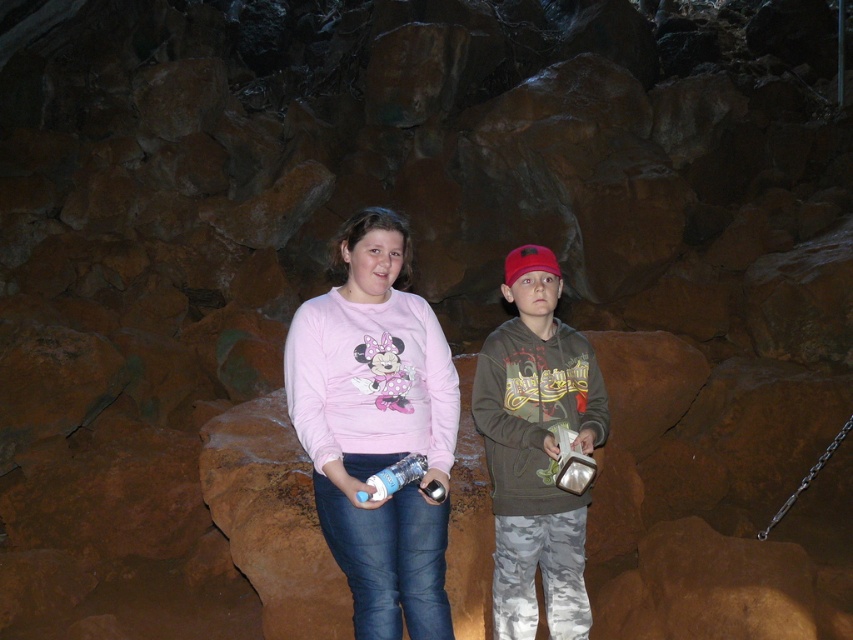
You are inside a cave with dim lighting. You see a matte pink sweatshirt at center and camouflage pants at center. Which object is shorter?

The matte pink sweatshirt at center is shorter than the camouflage pants at center.

You are a photographer trying to capture a portrait of the person wearing the matte pink sweatshirt at center and camouflage pants at center in the cave. Since the lighting is dim, you want to ensure the sweatshirt and pants are both visible. Based on their positions, which clothing item should you focus on first to ensure proper exposure?

The matte pink sweatshirt at center is above camouflage pants at center, so you should focus on the matte pink sweatshirt at center first because it is closer to the light source and might be better lit, ensuring proper exposure.

You are exploring a cave with dim lighting and rugged rocks. You see a matte pink sweatshirt at center and camouflage pants at center. Which one is positioned to the left?

The matte pink sweatshirt at center is to the left of camouflage pants at center.